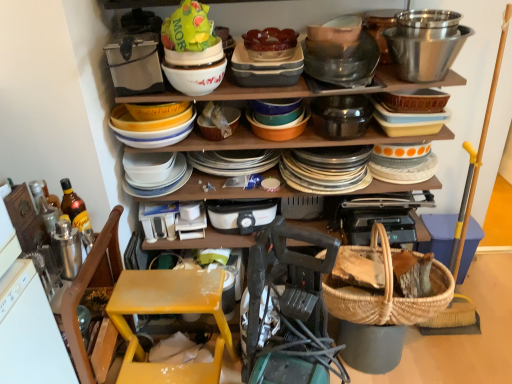
This screenshot has height=384, width=512. What do you see at coordinates (385, 291) in the screenshot?
I see `woven brown picnic basket at lower right` at bounding box center [385, 291].

What do you see at coordinates (188, 28) in the screenshot?
I see `green plastic bag at upper center` at bounding box center [188, 28].

In order to face yellow matte bowls at center, arranged as the second bowl when viewed from the right, should I rotate leftwards or rightwards?

You should look left and rotate roughly 13.324 degrees.

Locate an element on the screen. yellow matte bowls at center, arranged as the second bowl when viewed from the right is located at coordinates (150, 128).

Where is `woven brown picnic basket at lower right`? woven brown picnic basket at lower right is located at coordinates (385, 291).

Which is farther from the camera, (351, 80) or (120, 133)?

The point (351, 80) is farther from the camera.

From a real-world perspective, is metallic silver bowl at upper center, which ranks as the 2th bucket in right-to-left order, located beneath yellow matte bowls at center, arranged as the second bowl when viewed from the right?

No, from a real-world perspective, metallic silver bowl at upper center, which ranks as the 2th bucket in right-to-left order, is not beneath yellow matte bowls at center, arranged as the second bowl when viewed from the right.

In the image, is metallic silver bowl at upper center, which ranks as the 2th bucket in right-to-left order, positioned in front of or behind yellow matte bowls at center, arranged as the second bowl when viewed from the right?

metallic silver bowl at upper center, which ranks as the 2th bucket in right-to-left order, is behind yellow matte bowls at center, arranged as the second bowl when viewed from the right.

Based on the photo, between metallic silver bowl at upper center, which ranks as the 2th bucket in right-to-left order, and yellow matte bowls at center, arranged as the second bowl when viewed from the right, which one has smaller width?

With smaller width is yellow matte bowls at center, arranged as the second bowl when viewed from the right.

From the image's perspective, is woven brown picnic basket at lower right above yellow plastic step stool at lower left?

Yes, from the image's perspective, woven brown picnic basket at lower right is over yellow plastic step stool at lower left.

Is woven brown picnic basket at lower right inside the boundaries of yellow plastic step stool at lower left, or outside?

woven brown picnic basket at lower right is not enclosed by yellow plastic step stool at lower left.

Between woven brown picnic basket at lower right and yellow plastic step stool at lower left, which one appears on the left side from the viewer's perspective?

yellow plastic step stool at lower left.

From a real-world perspective, is woven brown picnic basket at lower right located higher than yellow plastic step stool at lower left?

Indeed, from a real-world perspective, woven brown picnic basket at lower right stands above yellow plastic step stool at lower left.

From the image's perspective, is green plastic bag at upper center located beneath woven straw basket at lower center, the 1th basket in the back-to-front sequence?

Incorrect, from the image's perspective, green plastic bag at upper center is higher than woven straw basket at lower center, the 1th basket in the back-to-front sequence.

Which is more to the left, green plastic bag at upper center or woven straw basket at lower center, the 1th basket in the back-to-front sequence?

Positioned to the left is woven straw basket at lower center, the 1th basket in the back-to-front sequence.

This screenshot has width=512, height=384. In order to click on food above the woven straw basket at lower center, the 1th basket in the back-to-front sequence (from a real-world perspective) in this screenshot , I will do `click(188, 28)`.

Is green plastic bag at upper center not inside woven straw basket at lower center, placed as the 2th basket when sorted from top to bottom?

Absolutely, green plastic bag at upper center is external to woven straw basket at lower center, placed as the 2th basket when sorted from top to bottom.

Considering the relative sizes of woven straw basket at center, which appears as the 1th basket when viewed from the front, and woven brown picnic basket at lower right in the image provided, is woven straw basket at center, which appears as the 1th basket when viewed from the front, bigger than woven brown picnic basket at lower right?

Actually, woven straw basket at center, which appears as the 1th basket when viewed from the front, might be smaller than woven brown picnic basket at lower right.

Is woven straw basket at center, which appears as the 1th basket when viewed from the front, inside the boundaries of woven brown picnic basket at lower right, or outside?

woven straw basket at center, which appears as the 1th basket when viewed from the front, is not inside woven brown picnic basket at lower right, it's outside.

Is woven straw basket at center, placed as the 2th basket when sorted from bottom to top, positioned with its back to woven brown picnic basket at lower right?

No, woven straw basket at center, placed as the 2th basket when sorted from bottom to top,'s orientation is not away from woven brown picnic basket at lower right.

Does woven straw basket at center, which is the 2th basket from back to front, lie in front of woven brown picnic basket at lower right?

Yes, it is in front of woven brown picnic basket at lower right.

Relative to metallic silver toaster at upper left, the 1th appliance when ordered from top to bottom, is translucent amber glass bottle at left in front or behind?

translucent amber glass bottle at left is positioned closer to the viewer than metallic silver toaster at upper left, the 1th appliance when ordered from top to bottom.

How much distance is there between translucent amber glass bottle at left and metallic silver toaster at upper left, the 1th appliance when ordered from top to bottom?

translucent amber glass bottle at left is 18.00 inches away from metallic silver toaster at upper left, the 1th appliance when ordered from top to bottom.

Can you tell me how much translucent amber glass bottle at left and metallic silver toaster at upper left, marked as the 2th appliance in a right-to-left arrangement, differ in facing direction?

translucent amber glass bottle at left and metallic silver toaster at upper left, marked as the 2th appliance in a right-to-left arrangement, are facing 89.6 degrees away from each other.

Based on their positions, is translucent amber glass bottle at left located to the left or right of metallic silver toaster at upper left, positioned as the first appliance in left-to-right order?

Based on their positions, translucent amber glass bottle at left is located to the left of metallic silver toaster at upper left, positioned as the first appliance in left-to-right order.

Would you say matte ceramic dishes at center is to the left or to the right of metallic silver bowl at upper center, which is the 1th bucket from left to right, in the picture?

In the image, matte ceramic dishes at center appears on the left side of metallic silver bowl at upper center, which is the 1th bucket from left to right.

Can we say matte ceramic dishes at center lies outside metallic silver bowl at upper center, which ranks as the 2th bucket in right-to-left order?

Yes.

Which point is more distant from viewer, (445, 129) or (328, 63)?

Positioned behind is point (328, 63).

From a real-world perspective, relative to metallic silver bowl at upper center, which is the 1th bucket from left to right, is matte ceramic dishes at center vertically above or below?

In terms of real-world spatial position, matte ceramic dishes at center is below metallic silver bowl at upper center, which is the 1th bucket from left to right.

Consider the image. How different are the orientations of green plastic bag at upper center and translucent amber glass bottle at left in degrees?

The facing directions of green plastic bag at upper center and translucent amber glass bottle at left are 89.6 degrees apart.

In terms of height, does green plastic bag at upper center look taller or shorter compared to translucent amber glass bottle at left?

green plastic bag at upper center is shorter than translucent amber glass bottle at left.

Is point (195, 2) more distant than point (84, 212)?

No, it is in front of (84, 212).

Considering the positions of objects green plastic bag at upper center and translucent amber glass bottle at left in the image provided, who is behind, green plastic bag at upper center or translucent amber glass bottle at left?

translucent amber glass bottle at left is further from the camera.

Where is `the 2nd bowl below the metallic silver bowl at upper center, which ranks as the 2th bucket in right-to-left order (from the image's perspective)`? the 2nd bowl below the metallic silver bowl at upper center, which ranks as the 2th bucket in right-to-left order (from the image's perspective) is located at coordinates (150, 128).

The width and height of the screenshot is (512, 384). I want to click on picnic basket positioned vertically above the yellow plastic step stool at lower left (from a real-world perspective), so click(x=385, y=291).

Considering their positions, is yellow plastic step stool at lower left positioned closer to black plastic toaster at center, marked as the 1th appliance in a bottom-to-top arrangement, than yellow matte bowls at center, positioned as the 1th bowl in left-to-right order?

The object closer to black plastic toaster at center, marked as the 1th appliance in a bottom-to-top arrangement, is yellow matte bowls at center, positioned as the 1th bowl in left-to-right order.

Considering their positions, is polished stainless steel bowl at upper right, which is counted as the 1th bucket, starting from the right, positioned further to translucent amber glass bottle at left than white glossy bowl at upper center, the first bowl in the right-to-left sequence?

polished stainless steel bowl at upper right, which is counted as the 1th bucket, starting from the right, is positioned further to the anchor translucent amber glass bottle at left.

Based on their spatial positions, is polished stainless steel bowl at upper right, which is counted as the 1th bucket, starting from the right, or translucent glass bowl at upper center further from yellow plastic step stool at lower left?

Based on the image, polished stainless steel bowl at upper right, which is counted as the 1th bucket, starting from the right, appears to be further to yellow plastic step stool at lower left.

Looking at this image, considering their positions, is woven straw basket at center, which is the 2th basket from back to front, positioned closer to translucent glass bowl at upper center than green plastic bag at upper center?

green plastic bag at upper center lies closer to translucent glass bowl at upper center than the other object.

From the image, which object appears to be nearer to translucent glass bowl at upper center, metallic silver bowl at upper center, which ranks as the 2th bucket in right-to-left order, or brushed metal coffee cup at left?

The object closer to translucent glass bowl at upper center is metallic silver bowl at upper center, which ranks as the 2th bucket in right-to-left order.

From the image, which object appears to be farther from translucent glass bowl at upper center, woven brown picnic basket at lower right or translucent amber glass bottle at left?

woven brown picnic basket at lower right lies further to translucent glass bowl at upper center than the other object.

From the image, which object appears to be nearer to metallic silver bowl at upper center, which is the 1th bucket from left to right, metallic silver toaster at upper left, which ranks as the 1th appliance in front-to-back order, or matte ceramic dishes at center?

matte ceramic dishes at center lies closer to metallic silver bowl at upper center, which is the 1th bucket from left to right, than the other object.

When comparing their distances from yellow matte bowls at center, positioned as the 1th bowl in left-to-right order, does brushed metal coffee cup at left or white glossy bowl at upper center, the 2th bowl from the left, seem further?

brushed metal coffee cup at left is further to yellow matte bowls at center, positioned as the 1th bowl in left-to-right order.

Locate an element on the screen. The height and width of the screenshot is (384, 512). basket that lies between white glossy bowl at upper center, the first bowl in the right-to-left sequence, and woven straw basket at lower center, the 1th basket in the back-to-front sequence, from top to bottom is located at coordinates (x=209, y=129).

Locate an element on the screen. bowl located between yellow matte bowls at center, arranged as the second bowl when viewed from the right, and woven wicker basket at lower right in the left-right direction is located at coordinates (195, 77).

The width and height of the screenshot is (512, 384). I want to click on basket between green plastic bag at upper center and woven wicker basket at lower right from left to right, so click(209, 129).

The width and height of the screenshot is (512, 384). What are the coordinates of `bottle that lies between metallic silver bowl at upper center, which is the 1th bucket from left to right, and yellow plastic step stool at lower left from top to bottom` in the screenshot? It's located at (76, 210).